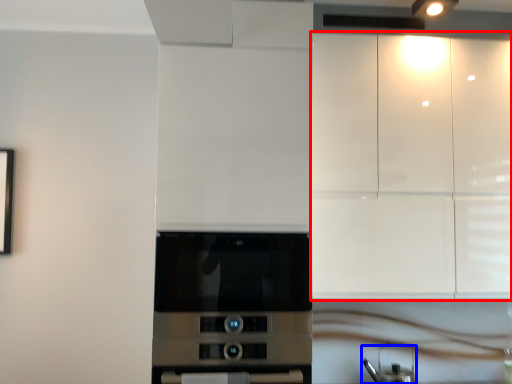
Question: Which point is further to the camera, cabinetry (highlighted by a red box) or appliance (highlighted by a blue box)?

Choices:
 (A) cabinetry
 (B) appliance

Answer: (B)